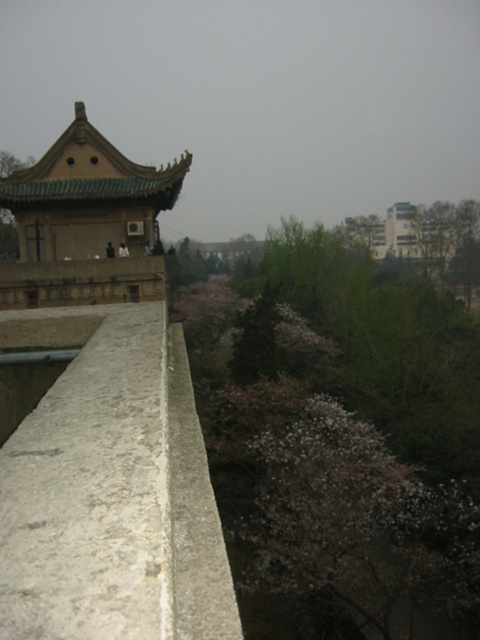
Question: Is bare branches at center to the left of green glazed tile temple at upper left from the viewer's perspective?

Choices:
 (A) no
 (B) yes

Answer: (A)

Question: Which object is farther from the camera taking this photo?

Choices:
 (A) green glazed tile temple at upper left
 (B) bare branches at center

Answer: (A)

Question: Does bare branches at center lie in front of green glazed tile temple at upper left?

Choices:
 (A) no
 (B) yes

Answer: (B)

Question: Is bare branches at center positioned before green glazed tile temple at upper left?

Choices:
 (A) no
 (B) yes

Answer: (B)